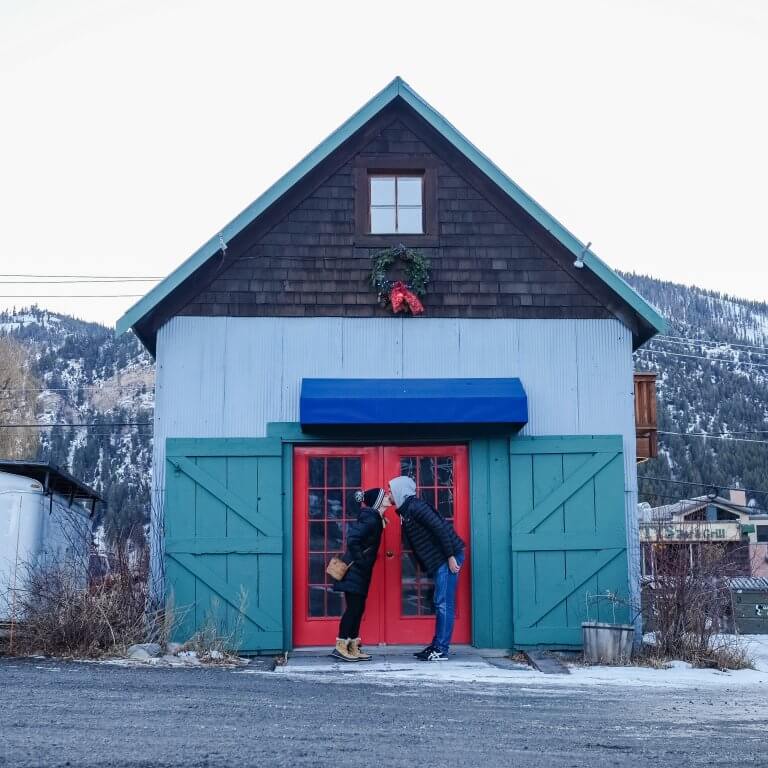
Where is `wreath`? wreath is located at coordinates (402, 257).